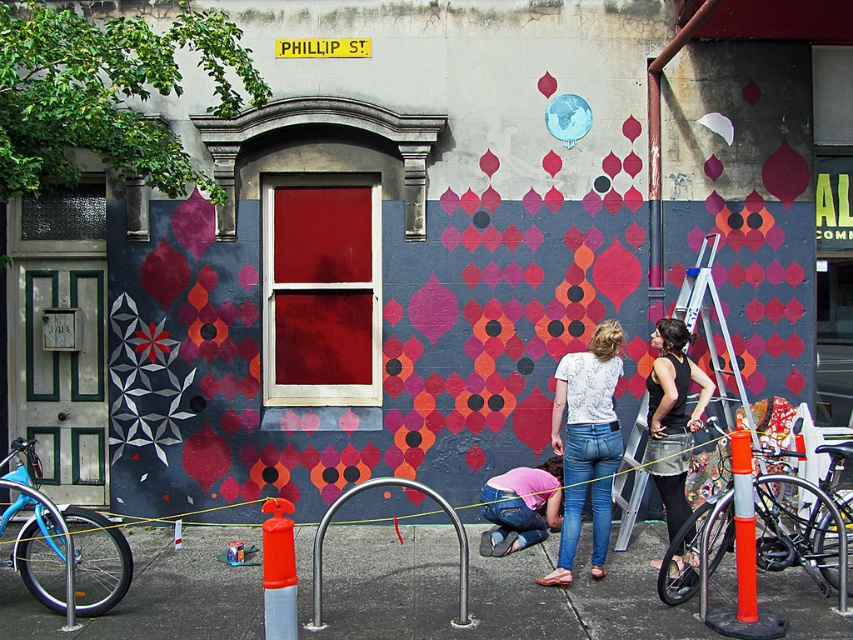
You are an artist planning to paint a new design on the black mesh tank top at center and the pink fabric at center. Since you want to ensure the designs are balanced, which object should you make the design larger on?

You should make the design larger on the pink fabric at center because the black mesh tank top at center has a lesser width compared to the pink fabric at center, so the design on the pink fabric can be larger to maintain balance.

You are a delivery person needing to park your blue matte bicycle at left near the building on Phillip Street. The parking spot you want is at point 0.853, 0.075. Is your bicycle already in the correct parking spot?

The blue matte bicycle at left is located at point [62,545], so yes, the bicycle is already in the correct parking spot.